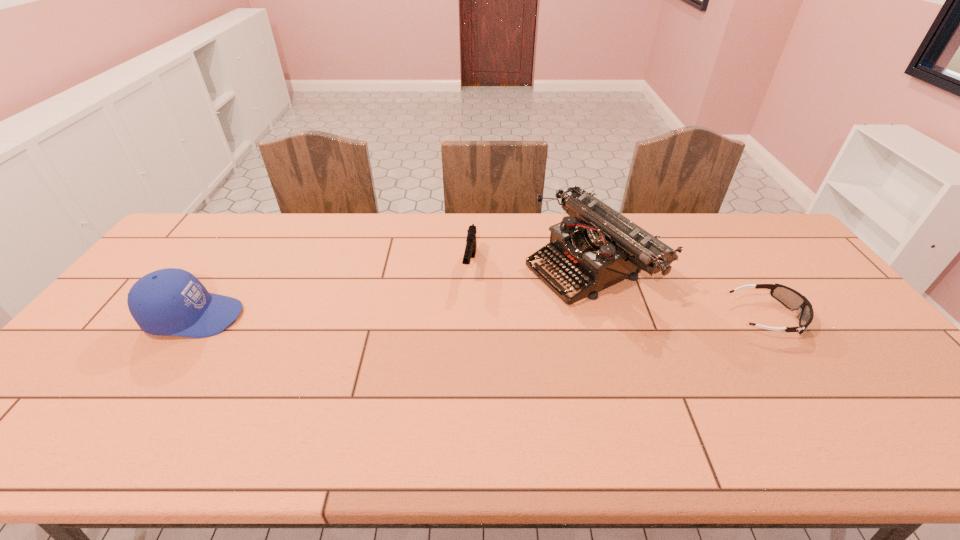
Find the location of a particular element. The height and width of the screenshot is (540, 960). free spot located on the keyboard of the tallest object is located at coordinates (514, 300).

Where is `vacant space positioned on the keyboard of the tallest object`? The width and height of the screenshot is (960, 540). vacant space positioned on the keyboard of the tallest object is located at coordinates (434, 335).

Where is `vacant area situated 0.110m on the keyboard of the tallest object`? vacant area situated 0.110m on the keyboard of the tallest object is located at coordinates (508, 302).

Find the location of a particular element. The height and width of the screenshot is (540, 960). vacant region located 0.100m on the front-facing side of the third object from right to left is located at coordinates (465, 309).

Identify the location of free spot located 0.370m on the front-facing side of the third object from right to left. This screenshot has height=540, width=960. pos(450,388).

Where is `vacant space positioned on the front-facing side of the third object from right to left`? The image size is (960, 540). vacant space positioned on the front-facing side of the third object from right to left is located at coordinates (465, 306).

Image resolution: width=960 pixels, height=540 pixels. What are the coordinates of `typewriter at the far edge` in the screenshot? It's located at (598, 247).

Identify the location of pistol that is positioned at the far edge. (470, 250).

This screenshot has width=960, height=540. I want to click on object located at the left edge, so click(x=171, y=301).

Find the location of a particular element. object that is at the right edge is located at coordinates (790, 298).